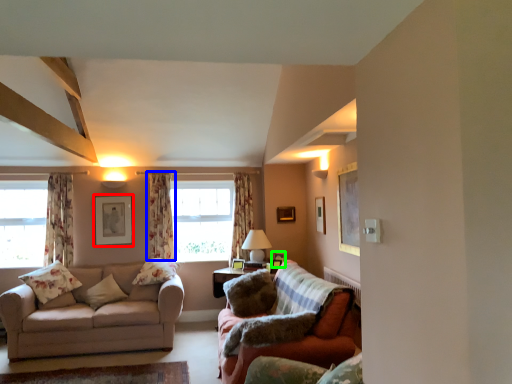
Question: Estimate the real-world distances between objects in this image. Which object is farther from picture frame (highlighted by a red box), curtain (highlighted by a blue box) or picture frame (highlighted by a green box)?

Choices:
 (A) curtain
 (B) picture frame

Answer: (B)